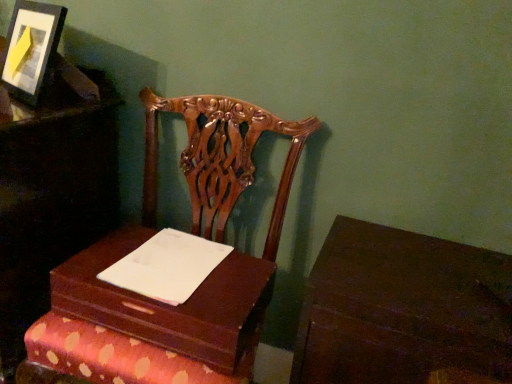
Locate an element on the screen. This screenshot has width=512, height=384. free space above white paper at center (from a real-world perspective) is located at coordinates (163, 266).